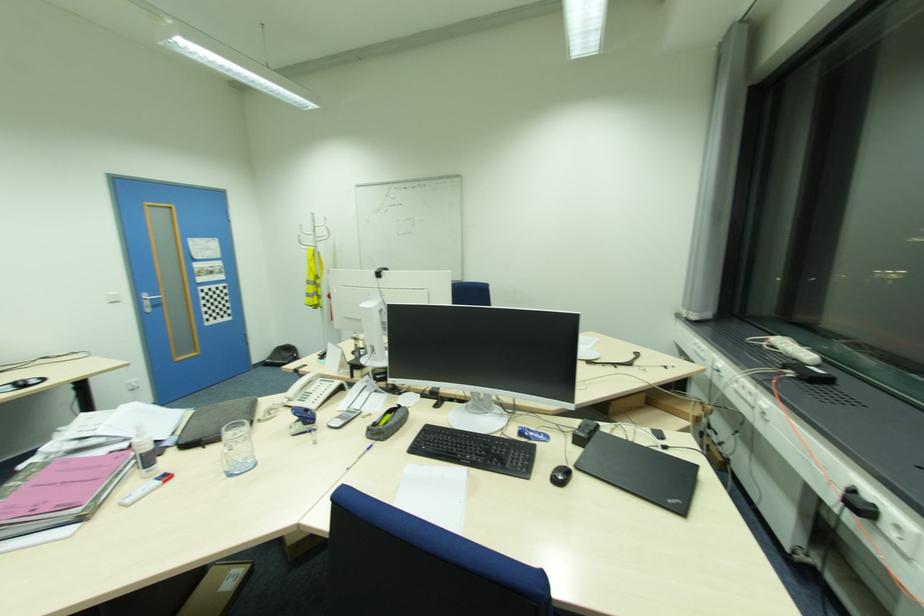
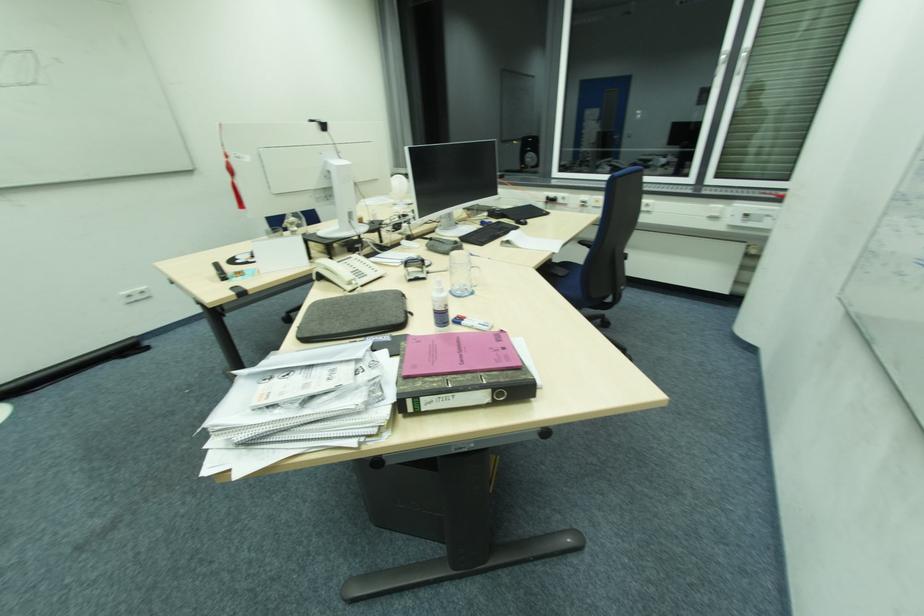
The point at (324, 379) is marked in the first image. Where is the corresponding point in the second image?

(342, 262)